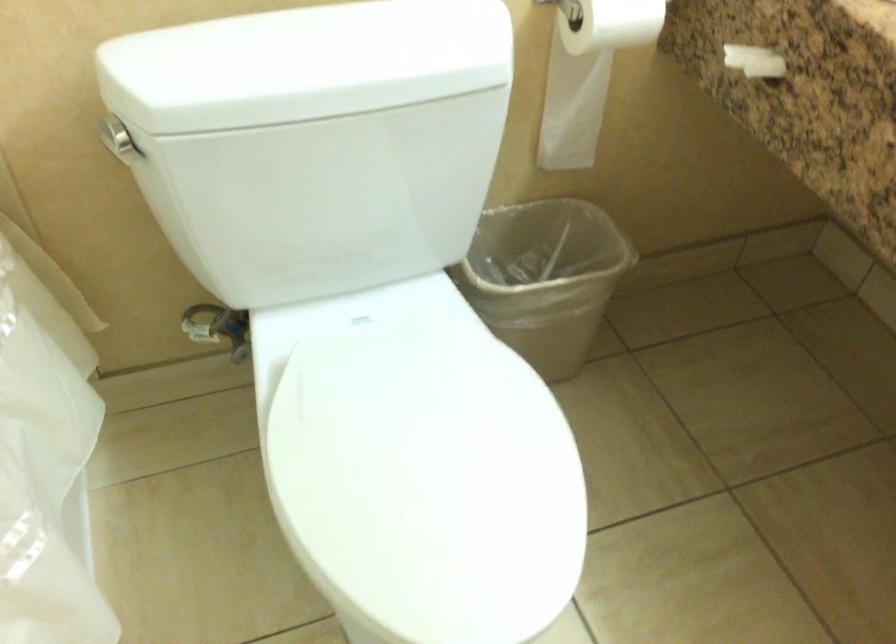
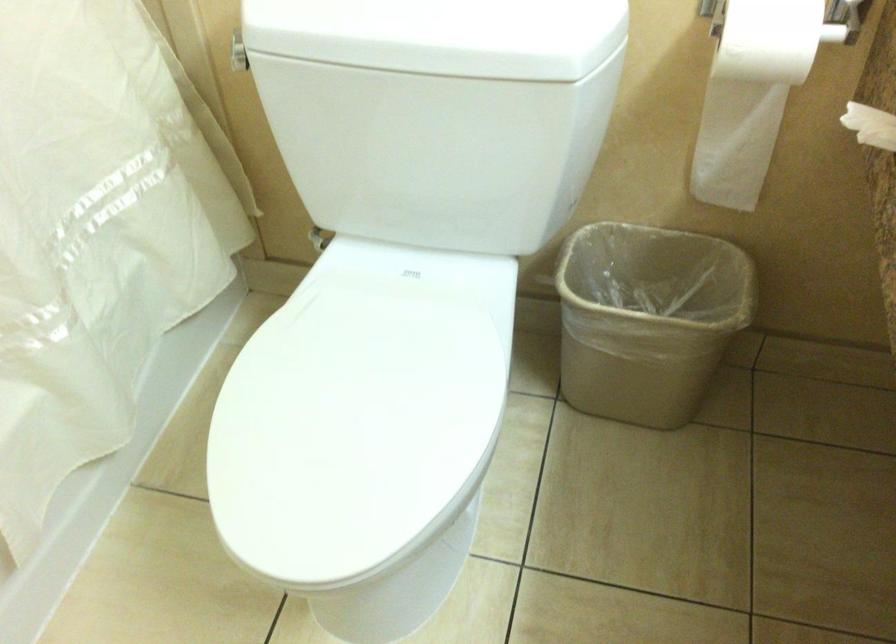
In the second image, find the point that corresponds to [565,283] in the first image.

(647, 319)